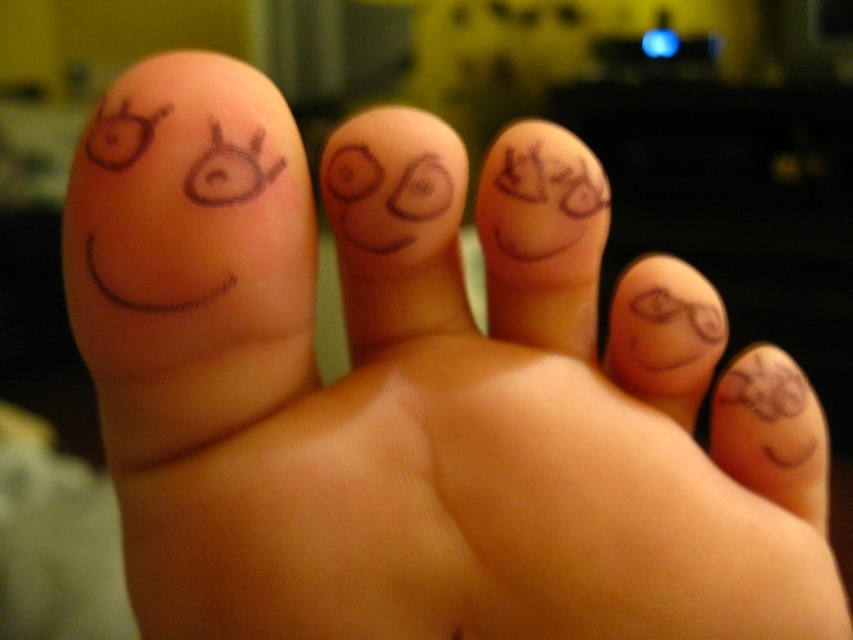
Is brown ink drawing at left wider than smooth skin at lower right?

Yes.

Locate an element on the screen. brown ink drawing at left is located at coordinates (189, 256).

Between matte black toe at upper center and matte black smiley face at lower right, which one is positioned lower?

matte black smiley face at lower right

This screenshot has height=640, width=853. What are the coordinates of `matte black toe at upper center` in the screenshot? It's located at (543, 237).

Describe the element at coordinates (543, 237) in the screenshot. I see `matte black toe at upper center` at that location.

I want to click on matte black toe at upper center, so click(x=543, y=237).

Which is above, matte black toe at upper center or smooth skin at lower right?

matte black toe at upper center

Is point (508, 196) positioned behind point (668, 321)?

No, it is in front of (668, 321).

The height and width of the screenshot is (640, 853). What are the coordinates of `matte black toe at upper center` in the screenshot? It's located at (543, 237).